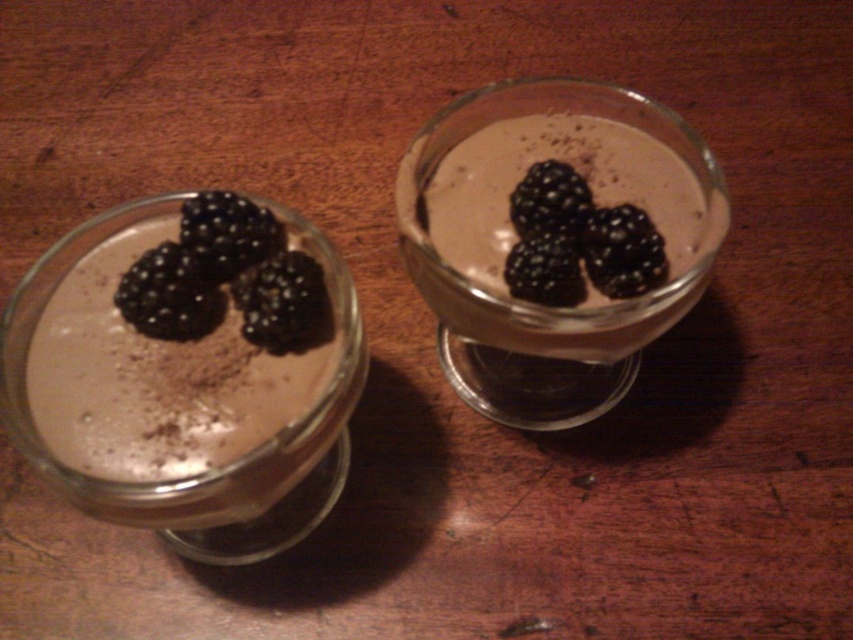
You are holding a small spoon that is 3 inches long. You want to reach the point at point (125, 298) to taste the dessert. Can your spoon reach that point if the spoon is placed at the edge of the wooden surface?

The distance of point (125, 298) from viewer is 11.57 inches, so the spoon cannot reach that point since it is only 3 inches long.